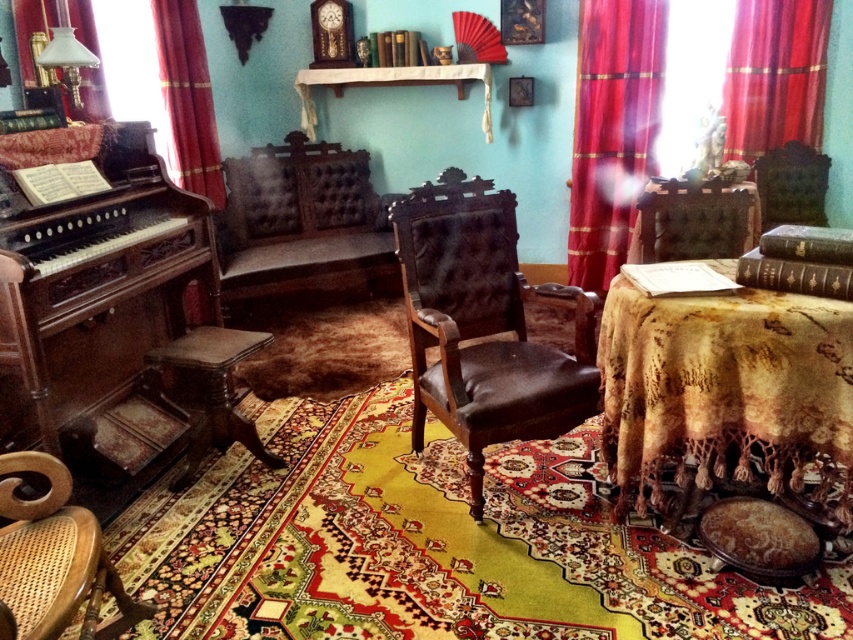
You are standing at point (219, 429) and want to walk to point (788, 77). Is the destination point behind you relative to your current position?

Yes, the destination point (788, 77) is behind your current position at (219, 429), so it is behind you.

You are standing in the room and want to move from the red velvet curtain at left to the wooden polished stool at lower left. Which direction should you move to reach the stool?

The red velvet curtain at left is to the left of the wooden polished stool at lower left, so you should move to the right to reach the stool.

You are a stagehand preparing to move a 3.5 meter long stage prop from the back of the room to the front. You need to pass by the red velvet curtain at left. Can you safely move the prop past the curtain without hitting it?

The red velvet curtain at left is 3.72 meters from the camera. Since the prop is 3.5 meters long, it can be moved past the curtain as long as it is kept parallel to the wall and does not extend beyond the 3.72 meter distance. However, caution is advised to ensure no part of the prop comes into contact with the curtain during transit.